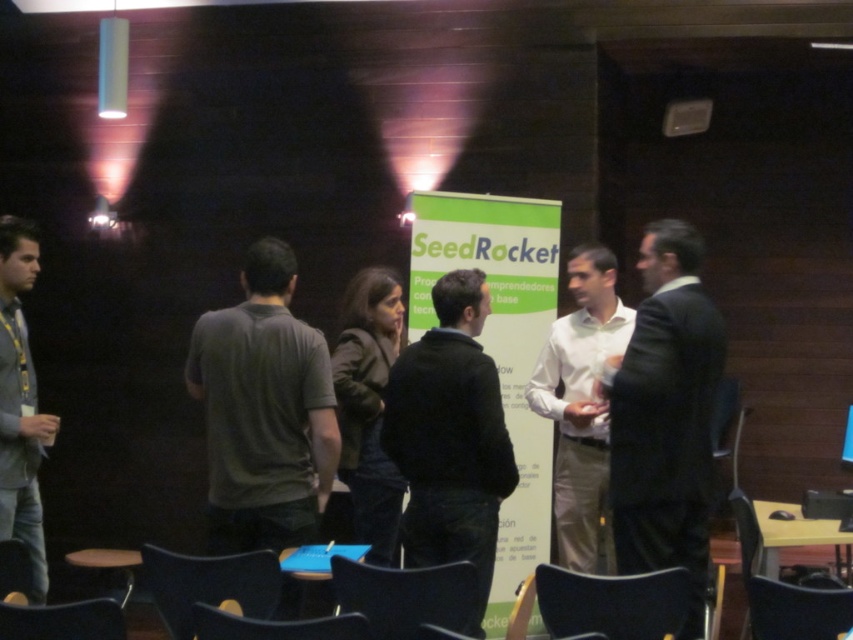
You are a guest at this event and need to sit down. You see the black plastic chair at lower right and the matte black chair at lower center. Which chair is taller?

The black plastic chair at lower right is taller than the matte black chair at lower center.

You are a guest at this event and want to sit down. You see a black plastic chair at lower left and a matte black chair at lower center. Which chair is closer to you?

The black plastic chair at lower left is closer to you because it is further to the viewer than the matte black chair at lower center.